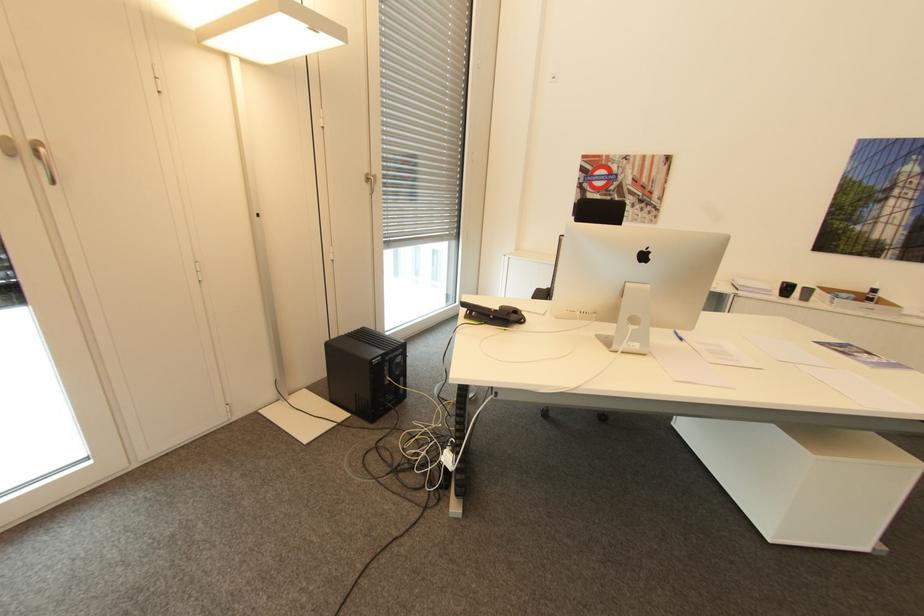
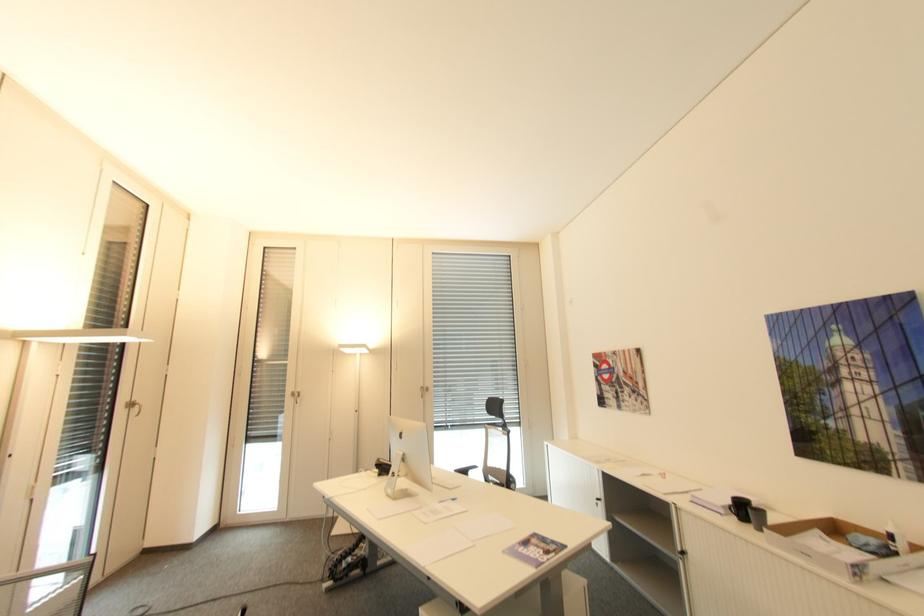
In the second image, find the point that corresponds to pixel 879 290 in the first image.

(895, 537)